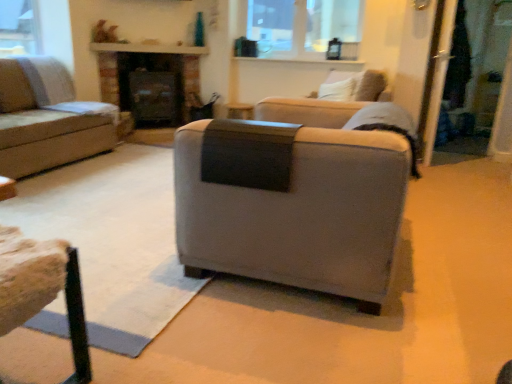
Measure the distance between point [486,0] and camera.

Point [486,0] is 15.11 feet from camera.

What do you see at coordinates (474, 75) in the screenshot? The width and height of the screenshot is (512, 384). I see `transparent plastic screen door at right, acting as the first screen door starting from the right` at bounding box center [474, 75].

Describe the element at coordinates (435, 76) in the screenshot. I see `clear glass screen door at right, positioned as the first screen door in left-to-right order` at that location.

The image size is (512, 384). What do you see at coordinates (303, 27) in the screenshot?
I see `clear glass window at upper center` at bounding box center [303, 27].

What do you see at coordinates (292, 199) in the screenshot?
I see `suede gray armchair at center, acting as the second studio couch starting from the left` at bounding box center [292, 199].

Where is `matte wood mantle at upper center`? The image size is (512, 384). matte wood mantle at upper center is located at coordinates (148, 48).

What is the approximate width of matte wood mantle at upper center?

4.48 inches.

Where is `light gray fabric armchair at upper right`? light gray fabric armchair at upper right is located at coordinates (322, 105).

Considering the sizes of light gray fabric armchair at upper right and matte black fireplace at center in the image, is light gray fabric armchair at upper right taller or shorter than matte black fireplace at center?

In the image, light gray fabric armchair at upper right appears to be shorter than matte black fireplace at center.

Is light gray fabric armchair at upper right positioned behind matte black fireplace at center?

That is False.

Based on the photo, could you tell me if light gray fabric armchair at upper right is turned towards matte black fireplace at center?

Yes, light gray fabric armchair at upper right faces towards matte black fireplace at center.

Who is taller, suede gray armchair at center, the 2th studio couch in the top-to-bottom sequence, or light beige fabric couch at left, the 2th studio couch when ordered from front to back?

Standing taller between the two is suede gray armchair at center, the 2th studio couch in the top-to-bottom sequence.

From the image's perspective, is suede gray armchair at center, positioned as the first studio couch in front-to-back order, above light beige fabric couch at left, the 2th studio couch viewed from the right?

No.

Is suede gray armchair at center, the first studio couch ordered from the bottom, facing away from light beige fabric couch at left, the 2th studio couch viewed from the right?

suede gray armchair at center, the first studio couch ordered from the bottom, is not turned away from light beige fabric couch at left, the 2th studio couch viewed from the right.

How distant is suede gray armchair at center, arranged as the 1th studio couch when viewed from the right, from light beige fabric couch at left, the 2th studio couch when ordered from front to back?

suede gray armchair at center, arranged as the 1th studio couch when viewed from the right, and light beige fabric couch at left, the 2th studio couch when ordered from front to back, are 2.33 meters apart.

Which object is thinner, light beige fabric couch at left, which appears as the first studio couch when viewed from the top, or transparent plastic screen door at right, acting as the first screen door starting from the right?

With smaller width is transparent plastic screen door at right, acting as the first screen door starting from the right.

Is light beige fabric couch at left, the 2th studio couch when ordered from front to back, smaller than transparent plastic screen door at right, which is counted as the second screen door, starting from the left?

Incorrect, light beige fabric couch at left, the 2th studio couch when ordered from front to back, is not smaller in size than transparent plastic screen door at right, which is counted as the second screen door, starting from the left.

Is light beige fabric couch at left, which is counted as the first studio couch, starting from the left, taller or shorter than transparent plastic screen door at right, which is counted as the second screen door, starting from the left?

light beige fabric couch at left, which is counted as the first studio couch, starting from the left, is shorter than transparent plastic screen door at right, which is counted as the second screen door, starting from the left.

Is light beige fabric couch at left, which appears as the first studio couch when viewed from the top, facing away from transparent plastic screen door at right, acting as the first screen door starting from the right?

No.

Considering the sizes of objects suede gray armchair at center, the first studio couch ordered from the bottom, and light gray fabric armchair at upper right in the image provided, who is thinner, suede gray armchair at center, the first studio couch ordered from the bottom, or light gray fabric armchair at upper right?

Thinner between the two is light gray fabric armchair at upper right.

Considering the positions of point (440, 59) and point (188, 174), is point (440, 59) closer or farther from the camera than point (188, 174)?

Point (440, 59).

This screenshot has width=512, height=384. What are the coordinates of `the 1st screen door behind the suede gray armchair at center, the 2th studio couch in the top-to-bottom sequence` in the screenshot? It's located at pyautogui.click(x=435, y=76).

From the picture: Does clear glass screen door at right, positioned as the first screen door in left-to-right order, have a greater width compared to suede gray armchair at center, the 2th studio couch in the top-to-bottom sequence?

No.

Is clear glass screen door at right, which appears as the second screen door when viewed from the right, directly adjacent to suede gray armchair at center, the 2th studio couch in the top-to-bottom sequence?

No, clear glass screen door at right, which appears as the second screen door when viewed from the right, is not with suede gray armchair at center, the 2th studio couch in the top-to-bottom sequence.

How many degrees apart are the facing directions of clear glass window at upper center and clear glass screen door at right, positioned as the first screen door in left-to-right order?

The angular difference between clear glass window at upper center and clear glass screen door at right, positioned as the first screen door in left-to-right order, is 97.8 degrees.

Is clear glass window at upper center next to clear glass screen door at right, positioned as the first screen door in left-to-right order, and touching it?

No, clear glass window at upper center is not with clear glass screen door at right, positioned as the first screen door in left-to-right order.

From a real-world perspective, is clear glass window at upper center on clear glass screen door at right, positioned as the first screen door in left-to-right order?

Correct, in the physical world, clear glass window at upper center is higher than clear glass screen door at right, positioned as the first screen door in left-to-right order.

Is clear glass window at upper center turned away from clear glass screen door at right, positioned as the first screen door in left-to-right order?

No, clear glass window at upper center's orientation is not away from clear glass screen door at right, positioned as the first screen door in left-to-right order.

Between matte wood mantle at upper center and matte black fireplace at center, which one has less height?

Standing shorter between the two is matte wood mantle at upper center.

Is point (113, 49) positioned in front of point (164, 56)?

That is True.

From a real-world perspective, who is located higher, matte wood mantle at upper center or matte black fireplace at center?

In real-world perspective, matte wood mantle at upper center is above.

This screenshot has width=512, height=384. Find the location of `fireplace on the left of light gray fabric armchair at upper right`. fireplace on the left of light gray fabric armchair at upper right is located at coordinates pyautogui.click(x=151, y=88).

Image resolution: width=512 pixels, height=384 pixels. In order to click on studio couch that appears above the suede gray armchair at center, positioned as the first studio couch in front-to-back order (from a real-world perspective) in this screenshot , I will do `click(48, 118)`.

Considering their positions, is transparent plastic screen door at right, acting as the first screen door starting from the right, positioned further to suede gray armchair at center, positioned as the first studio couch in front-to-back order, than matte wood mantle at upper center?

matte wood mantle at upper center.

Considering their positions, is light beige fabric couch at left, the 2th studio couch when ordered from bottom to top, positioned closer to wooden textured stool at lower left than matte wood mantle at upper center?

light beige fabric couch at left, the 2th studio couch when ordered from bottom to top, is positioned closer to the anchor wooden textured stool at lower left.

When comparing their distances from clear glass screen door at right, positioned as the first screen door in left-to-right order, does wooden textured stool at lower left or clear glass window at upper center seem further?

The object further to clear glass screen door at right, positioned as the first screen door in left-to-right order, is wooden textured stool at lower left.

From the image, which object appears to be farther from matte wood mantle at upper center, wooden textured stool at lower left or light beige fabric couch at left, the 2th studio couch viewed from the right?

wooden textured stool at lower left lies further to matte wood mantle at upper center than the other object.

Based on their spatial positions, is matte black fireplace at center or wooden textured stool at lower left closer to matte wood mantle at upper center?

matte black fireplace at center is closer to matte wood mantle at upper center.

Looking at the image, which one is located further to clear glass screen door at right, positioned as the first screen door in left-to-right order, clear glass window at upper center or light beige fabric couch at left, which is counted as the first studio couch, starting from the left?

light beige fabric couch at left, which is counted as the first studio couch, starting from the left, is further to clear glass screen door at right, positioned as the first screen door in left-to-right order.

Looking at the image, which one is located closer to suede gray armchair at center, acting as the second studio couch starting from the left, matte wood mantle at upper center or transparent plastic screen door at right, acting as the first screen door starting from the right?

Based on the image, transparent plastic screen door at right, acting as the first screen door starting from the right, appears to be nearer to suede gray armchair at center, acting as the second studio couch starting from the left.

Considering their positions, is transparent plastic screen door at right, acting as the first screen door starting from the right, positioned further to suede gray armchair at center, the 2th studio couch in the top-to-bottom sequence, than clear glass window at upper center?

clear glass window at upper center is further to suede gray armchair at center, the 2th studio couch in the top-to-bottom sequence.

Where is `armchair between suede gray armchair at center, positioned as the first studio couch in front-to-back order, and transparent plastic screen door at right, which is counted as the second screen door, starting from the left, from front to back`? The height and width of the screenshot is (384, 512). armchair between suede gray armchair at center, positioned as the first studio couch in front-to-back order, and transparent plastic screen door at right, which is counted as the second screen door, starting from the left, from front to back is located at coordinates (322, 105).

In order to click on fireplace located between light beige fabric couch at left, the 2th studio couch when ordered from front to back, and clear glass window at upper center in the left-right direction in this screenshot , I will do `click(151, 88)`.

Where is `bay window situated between matte black fireplace at center and light gray fabric armchair at upper right from left to right`? The image size is (512, 384). bay window situated between matte black fireplace at center and light gray fabric armchair at upper right from left to right is located at coordinates (303, 27).

In order to click on mantle positioned between suede gray armchair at center, the first studio couch ordered from the bottom, and matte black fireplace at center from near to far in this screenshot , I will do `click(148, 48)`.